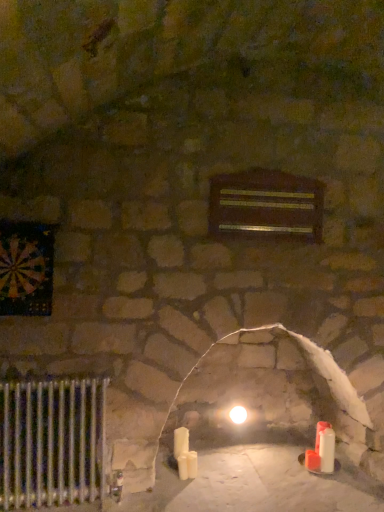
Question: Considering the relative positions of white matte candle at lower right, the 3th candle in the left-to-right sequence, and silver metallic radiator at lower left in the image provided, is white matte candle at lower right, the 3th candle in the left-to-right sequence, to the left or to the right of silver metallic radiator at lower left?

Choices:
 (A) right
 (B) left

Answer: (A)

Question: Does point (317, 434) appear closer or farther from the camera than point (18, 420)?

Choices:
 (A) farther
 (B) closer

Answer: (A)

Question: Considering the real-world distances, which object is closest to the white matte candle at lower right, the 3th candle in the left-to-right sequence?

Choices:
 (A) silver metallic radiator at lower left
 (B) white wax candle at center, which is the 1th candle from left to right
 (C) white glossy light bulb at center
 (D) white matte candle at center, which is the second candle from right to left
 (E) wooden plaque at center

Answer: (C)

Question: Which object is positioned farthest from the white wax candle at center, which is the 1th candle from left to right?

Choices:
 (A) silver metallic radiator at lower left
 (B) white matte candle at center, which is counted as the 2th candle, starting from the left
 (C) wooden plaque at center
 (D) white matte candle at lower right, the 3th candle in the left-to-right sequence
 (E) white glossy light bulb at center

Answer: (C)